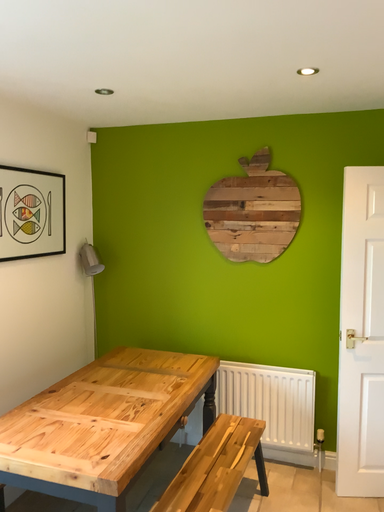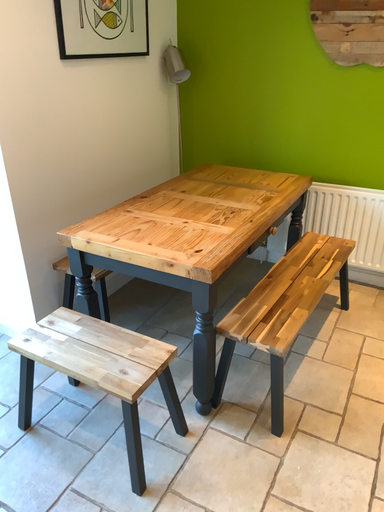
Question: How did the camera likely rotate when shooting the video?

Choices:
 (A) rotated upward
 (B) rotated downward

Answer: (B)